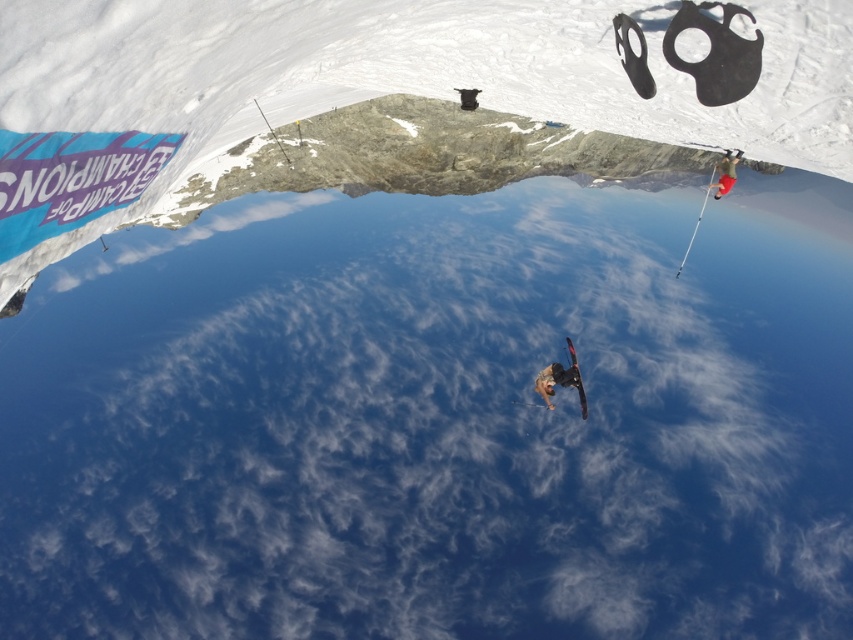
You are a photographer trying to capture the skier in the image. The red fabric pants at right is represented by point (x=724, y=172). Where should you position your camera to ensure the red fabric pants at right is in the center of your shot?

To center the red fabric pants at right, position your camera so that the point (x=724, y=172) is at the center of your viewfinder.

You are a photographer trying to capture the perfect shot of the dark gray snowboarder at center. The camera is positioned at point (555, 380). Where should you aim the camera to capture the dark gray snowboarder at center?

The dark gray snowboarder at center is located exactly at point (555, 380), so the camera should be aimed directly at that coordinate to capture it.

You are a photographer trying to capture the best shot of the dark gray snowboarder at center and the red fabric pants at right. Which object should you focus on first if you want to prioritize the one closer to the camera?

The dark gray snowboarder at center is positioned on the left side of red fabric pants at right, so the dark gray snowboarder at center is closer to the camera and should be focused on first.